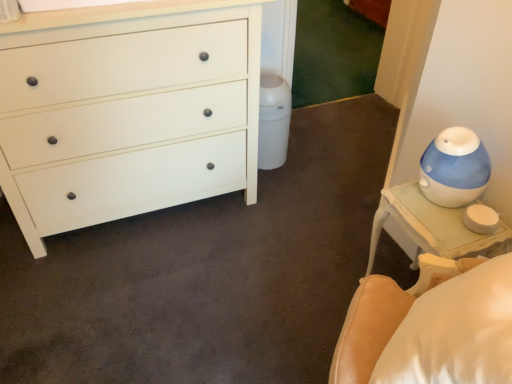
Where is `white glossy nightstand at right`? This screenshot has height=384, width=512. white glossy nightstand at right is located at coordinates (430, 225).

This screenshot has width=512, height=384. Describe the element at coordinates (430, 225) in the screenshot. I see `white glossy nightstand at right` at that location.

Locate an element on the screen. Image resolution: width=512 pixels, height=384 pixels. white matte chest of drawers at left is located at coordinates (128, 117).

What do you see at coordinates (128, 117) in the screenshot? I see `white matte chest of drawers at left` at bounding box center [128, 117].

Identify the location of white glossy nightstand at right. (430, 225).

Is white matte chest of drawers at left to the left of white glossy nightstand at right from the viewer's perspective?

Yes.

Which object is further away from the camera taking this photo, white matte chest of drawers at left or white glossy nightstand at right?

white glossy nightstand at right is more distant.

Is point (129, 109) closer to camera compared to point (499, 241)?

No.

From the picture: From the image's perspective, is white matte chest of drawers at left on white glossy nightstand at right?

Correct, white matte chest of drawers at left appears higher than white glossy nightstand at right in the image.

From a real-world perspective, who is located higher, white matte chest of drawers at left or white glossy nightstand at right?

white matte chest of drawers at left, from a real-world perspective.

Which object is wider, white matte chest of drawers at left or white glossy nightstand at right?

white matte chest of drawers at left is wider.

Considering the sizes of white matte chest of drawers at left and white glossy nightstand at right in the image, is white matte chest of drawers at left taller or shorter than white glossy nightstand at right?

In the image, white matte chest of drawers at left appears to be taller than white glossy nightstand at right.

Considering the relative sizes of white matte chest of drawers at left and white glossy nightstand at right in the image provided, is white matte chest of drawers at left smaller than white glossy nightstand at right?

Actually, white matte chest of drawers at left might be larger than white glossy nightstand at right.

Would you say white matte chest of drawers at left is outside white glossy nightstand at right?

white matte chest of drawers at left is positioned outside white glossy nightstand at right.

Is white matte chest of drawers at left beside white glossy nightstand at right?

white matte chest of drawers at left is not next to white glossy nightstand at right, and they're not touching.

Could you tell me if white matte chest of drawers at left is facing white glossy nightstand at right?

Yes, white matte chest of drawers at left is oriented towards white glossy nightstand at right.

How different are the orientations of white matte chest of drawers at left and white glossy nightstand at right in degrees?

There is a 90.7-degree angle between the facing directions of white matte chest of drawers at left and white glossy nightstand at right.

Measure the distance between white matte chest of drawers at left and white glossy nightstand at right.

The distance of white matte chest of drawers at left from white glossy nightstand at right is 36.19 inches.

Locate an element on the screen. The image size is (512, 384). the chest of drawers lying above the white glossy nightstand at right (from the image's perspective) is located at coordinates (128, 117).

Is white glossy nightstand at right to the left of white matte chest of drawers at left from the viewer's perspective?

In fact, white glossy nightstand at right is to the right of white matte chest of drawers at left.

Is white glossy nightstand at right positioned before white matte chest of drawers at left?

No.

Which point is more forward, (472, 248) or (68, 85)?

Point (472, 248)

From the image's perspective, who appears lower, white glossy nightstand at right or white matte chest of drawers at left?

From the image's view, white glossy nightstand at right is below.

From a real-world perspective, between white glossy nightstand at right and white matte chest of drawers at left, who is vertically higher?

In real-world perspective, white matte chest of drawers at left is above.

Does white glossy nightstand at right have a greater width compared to white matte chest of drawers at left?

Incorrect, the width of white glossy nightstand at right does not surpass that of white matte chest of drawers at left.

Considering the sizes of objects white glossy nightstand at right and white matte chest of drawers at left in the image provided, who is taller, white glossy nightstand at right or white matte chest of drawers at left?

With more height is white matte chest of drawers at left.

Based on the photo, does white glossy nightstand at right have a smaller size compared to white matte chest of drawers at left?

Indeed, white glossy nightstand at right has a smaller size compared to white matte chest of drawers at left.

Is white glossy nightstand at right located outside white matte chest of drawers at left?

white glossy nightstand at right lies outside white matte chest of drawers at left's area.

Based on the photo, is white glossy nightstand at right with white matte chest of drawers at left?

There is a gap between white glossy nightstand at right and white matte chest of drawers at left.

Is white glossy nightstand at right positioned with its back to white matte chest of drawers at left?

No.

Identify the location of nightstand that is below the white matte chest of drawers at left (from the image's perspective). Image resolution: width=512 pixels, height=384 pixels. (430, 225).

The height and width of the screenshot is (384, 512). In order to click on chest of drawers above the white glossy nightstand at right (from the image's perspective) in this screenshot , I will do `click(128, 117)`.

The height and width of the screenshot is (384, 512). There is a white glossy nightstand at right. Identify the location of the chest of drawers above it (from a real-world perspective). (128, 117).